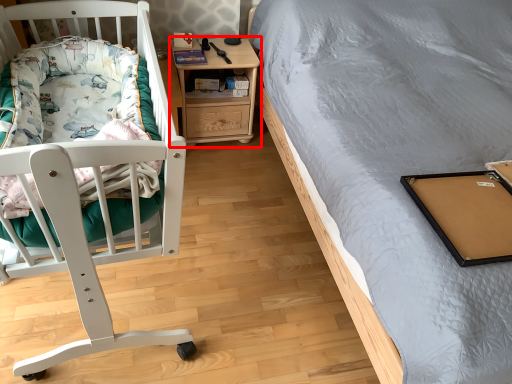
Question: From the image's perspective, where is nightstand (annotated by the red box) located in relation to blanket in the image?

Choices:
 (A) above
 (B) below

Answer: (A)